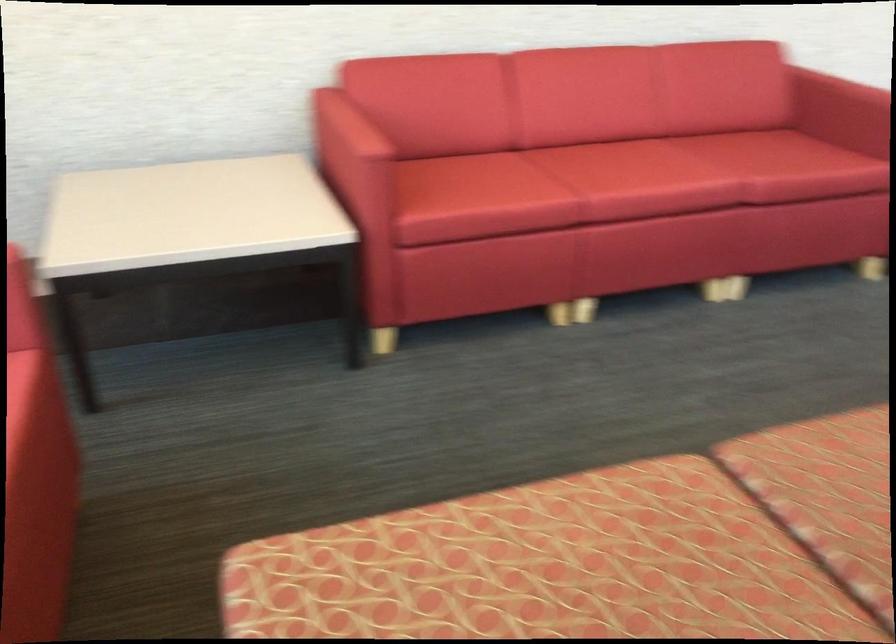
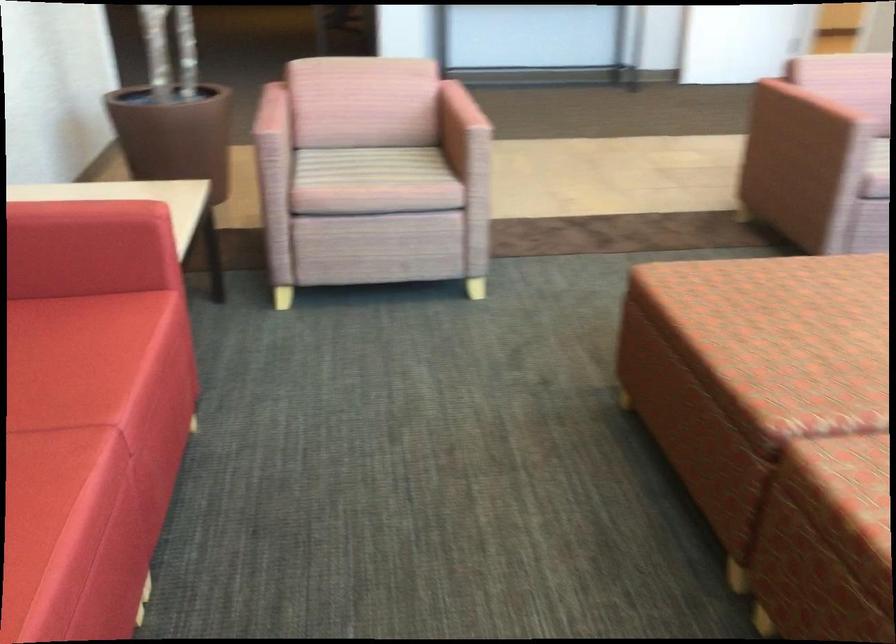
Locate, in the second image, the point that corresponds to (780,155) in the first image.

(69, 360)